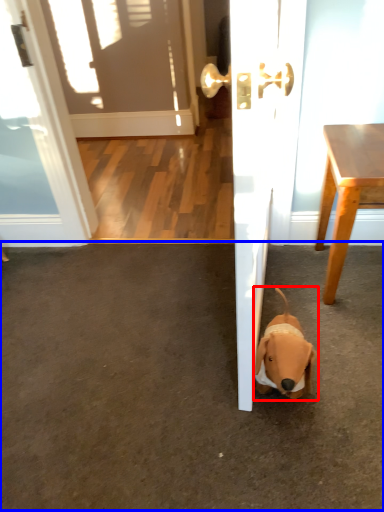
Question: Which of the following is the closest to the observer, dog (highlighted by a red box) or concrete (highlighted by a blue box)?

Choices:
 (A) dog
 (B) concrete

Answer: (B)